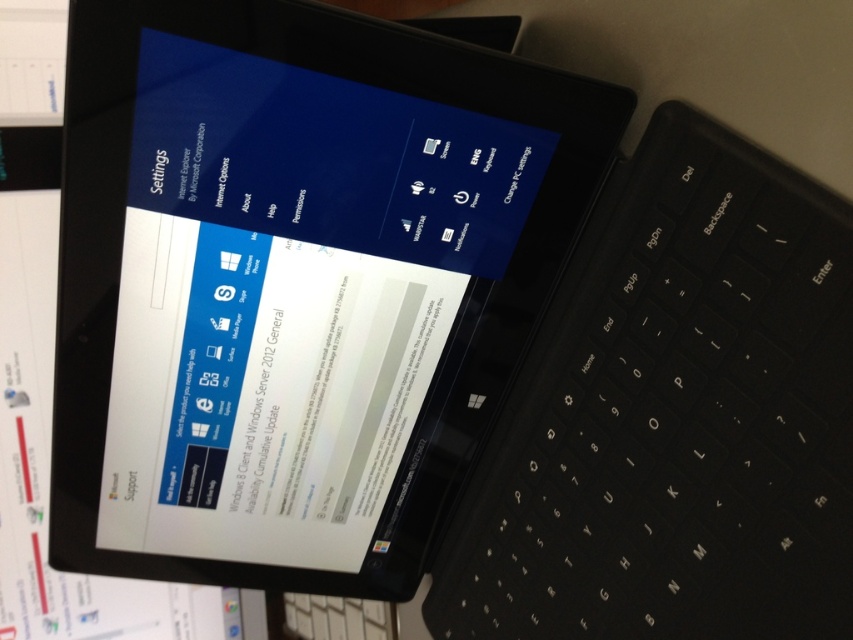
You are setting up a new computing station and need to place the black glossy tablet at center and the black plastic keyboard at center on a desk. If the desk has limited space, which object should you prioritize placing first to ensure both fit properly?

The black glossy tablet at center is bigger than the black plastic keyboard at center, so you should prioritize placing the black glossy tablet at center first to ensure there is enough space for both objects on the desk.

You are setting up a laptop station and need to place the black glossy tablet at center and the black plastic keyboard at center. Based on the scene, which object should be placed on top of the other?

The black glossy tablet at center should be placed on top of the black plastic keyboard at center because the black glossy tablet at center is above the black plastic keyboard at center in the scene.